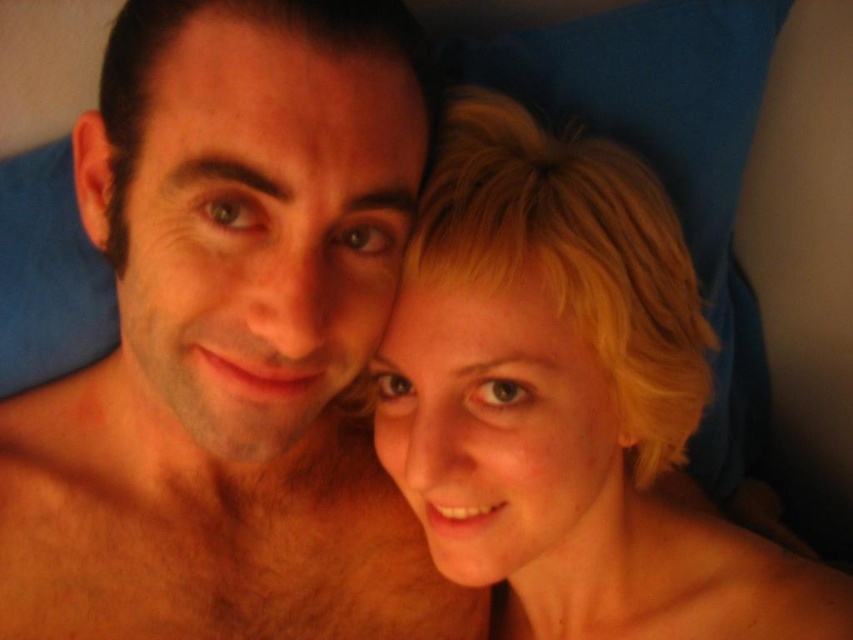
Question: Among these objects, which one is nearest to the camera?

Choices:
 (A) hairy skin at lower left
 (B) brown hair at left
 (C) blonde hair at center

Answer: (B)

Question: Does blonde hair at center appear under hairy skin at lower left?

Choices:
 (A) yes
 (B) no

Answer: (A)

Question: Observing the image, what is the correct spatial positioning of blonde hair at center in reference to hairy skin at lower left?

Choices:
 (A) right
 (B) left

Answer: (A)

Question: Among these points, which one is nearest to the camera?

Choices:
 (A) (553, 196)
 (B) (228, 632)
 (C) (401, 566)

Answer: (A)

Question: Among these objects, which one is farthest from the camera?

Choices:
 (A) hairy skin at lower left
 (B) brown hair at left
 (C) blonde hair at center

Answer: (C)

Question: Does brown hair at left appear over hairy skin at lower left?

Choices:
 (A) no
 (B) yes

Answer: (B)